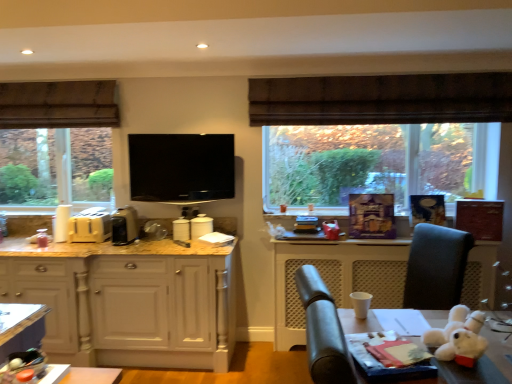
Image resolution: width=512 pixels, height=384 pixels. I want to click on free spot above brown fabric exhaust hood at upper left (from a real-world perspective), so click(x=59, y=77).